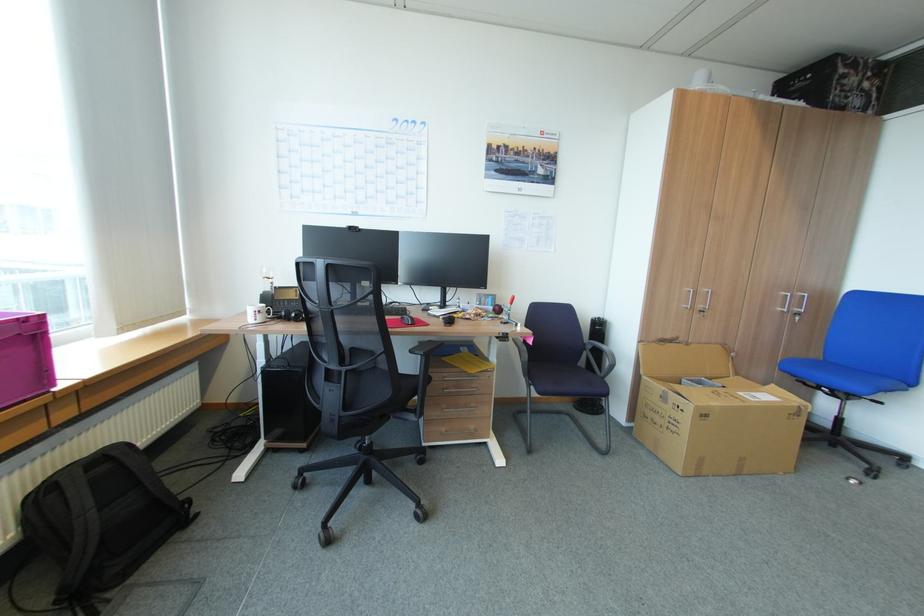
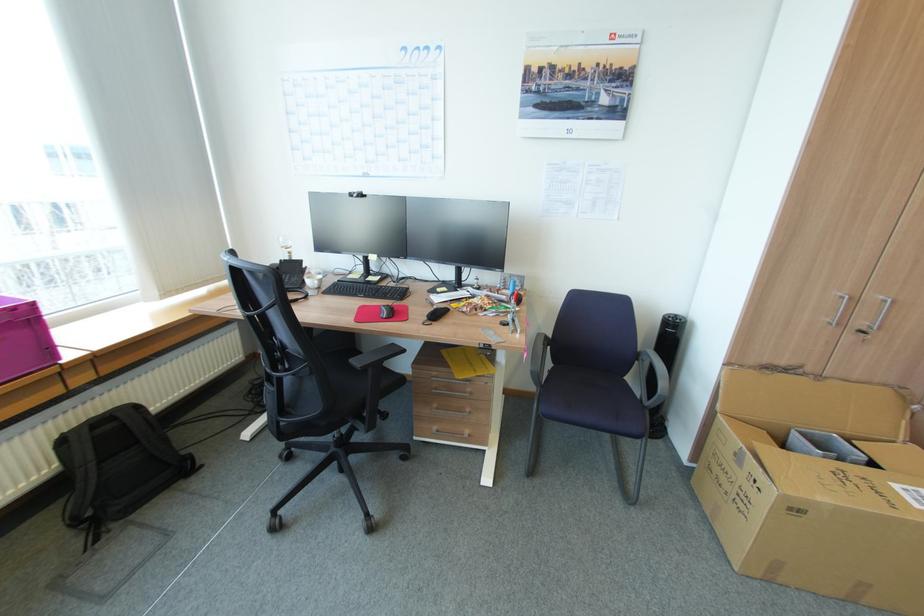
Where in the second image is the point corresponding to pixel 711 290 from the first image?

(888, 297)